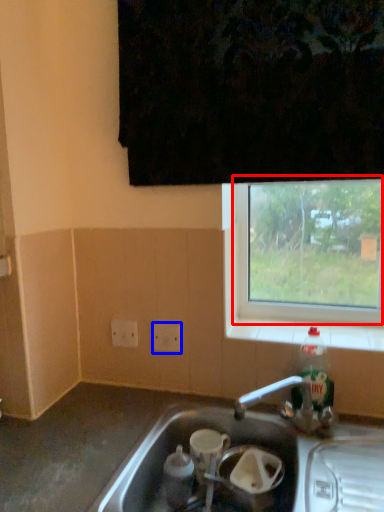
Question: Which object is closer to the camera taking this photo, window (highlighted by a red box) or electric outlet (highlighted by a blue box)?

Choices:
 (A) window
 (B) electric outlet

Answer: (A)